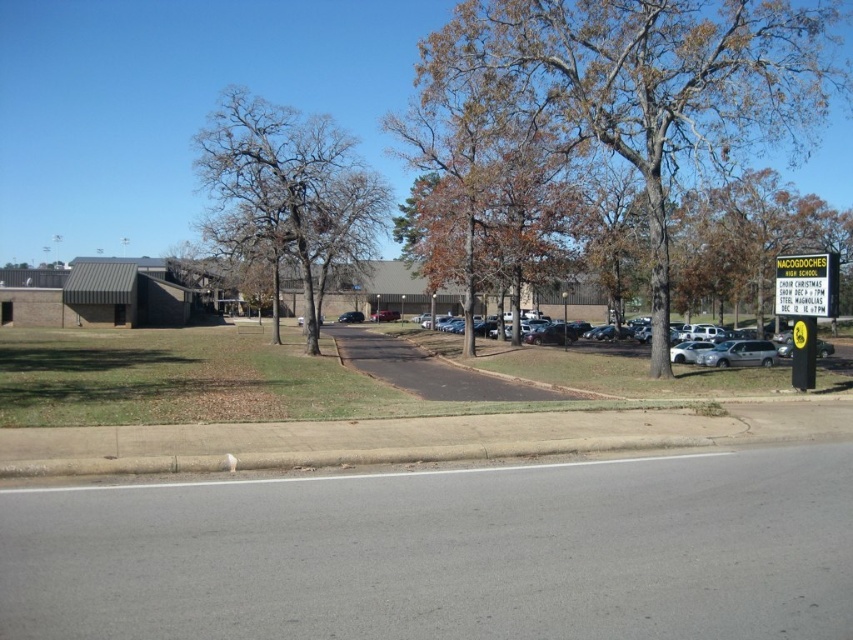
Between brown leafy tree at center and bare branches at left, which one is positioned higher?

Positioned higher is bare branches at left.

Can you confirm if brown leafy tree at center is shorter than bare branches at left?

Yes, brown leafy tree at center is shorter than bare branches at left.

Identify the location of brown leafy tree at center. This screenshot has width=853, height=640. (635, 84).

You are a GUI agent. You are given a task and a screenshot of the screen. Output one action in this format:
    pyautogui.click(x=<x>, y=<y>)
    Task: Click on the brown leafy tree at center
    Image resolution: width=853 pixels, height=640 pixels.
    Given the screenshot: What is the action you would take?
    pyautogui.click(x=635, y=84)

Between brown leafy tree at center and silver metallic sedan at center, which one is positioned lower?

silver metallic sedan at center is lower down.

Which of these two, brown leafy tree at center or silver metallic sedan at center, stands shorter?

With less height is silver metallic sedan at center.

Is point (491, 16) positioned before point (775, 362)?

Yes, point (491, 16) is closer to viewer.

Image resolution: width=853 pixels, height=640 pixels. I want to click on brown leafy tree at center, so click(635, 84).

Between yellow plastic sign at right and silver metallic sedan at center, which one appears on the left side from the viewer's perspective?

yellow plastic sign at right is more to the left.

Is yellow plastic sign at right taller than silver metallic sedan at center?

Indeed, yellow plastic sign at right has a greater height compared to silver metallic sedan at center.

Describe the element at coordinates (805, 305) in the screenshot. The height and width of the screenshot is (640, 853). I see `yellow plastic sign at right` at that location.

Where is `yellow plastic sign at right`? Image resolution: width=853 pixels, height=640 pixels. yellow plastic sign at right is located at coordinates (805, 305).